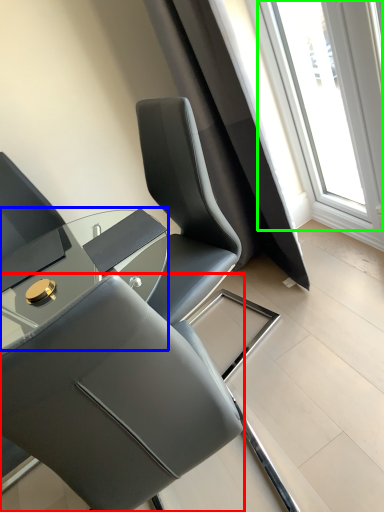
Question: Estimate the real-world distances between objects in this image. Which object is closer to chair (highlighted by a red box), table (highlighted by a blue box) or window (highlighted by a green box)?

Choices:
 (A) table
 (B) window

Answer: (A)